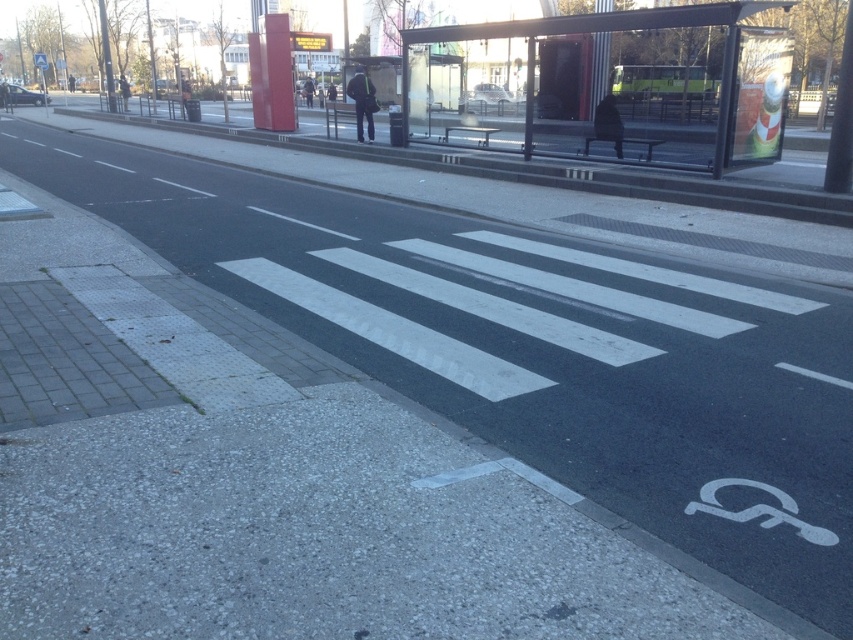
You are a delivery person standing at the bus stop shelter. You need to place a package on the gray concrete curb at center and the black fabric jacket at center. Which object should you place the package on, and why?

You should place the package on the gray concrete curb at center because it is positioned on the right side of the black fabric jacket at center, making it more accessible from your current position at the bus stop shelter.

You are a delivery person who needs to deliver a package to the transparent glass bus stop at upper center. However, there is a person wearing a dark blue jacket at center sitting inside the bus stop. Considering the height difference between the bus stop and the person, can you see the person from outside the bus stop?

The transparent glass bus stop at upper center has a lesser height compared to dark blue jacket at center, so the person wearing the dark blue jacket at center may not be fully visible from outside the bus stop due to the bus stop being shorter than the person.

You are standing at the bus stop shelter and want to walk to the point with coordinates point (724, 64) and point (120, 92). Which point is closer to you?

Point (724, 64) is closer to the viewer than point (120, 92), so you should walk to point (724, 64) first.